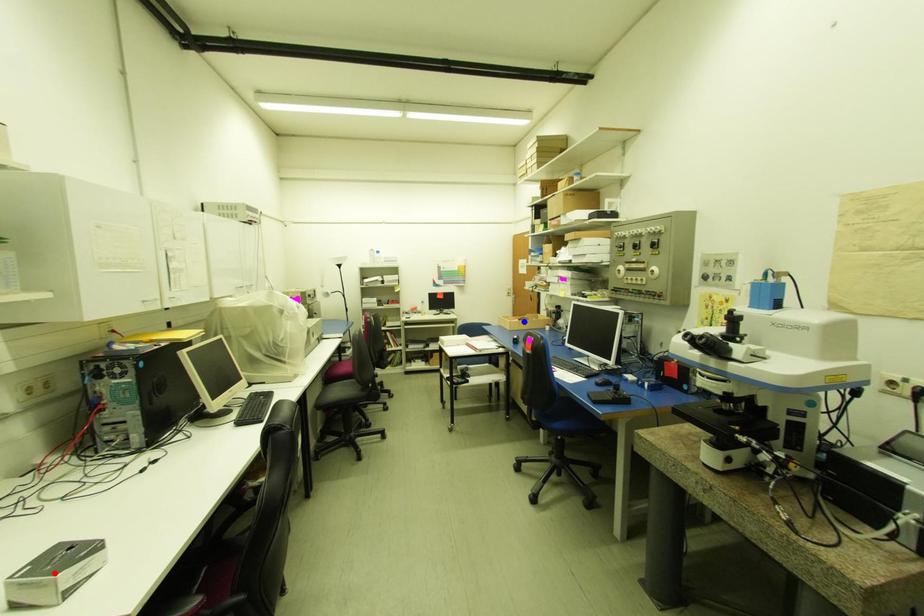
Question: Two points are marked on the image. Which point is closer to the camera?

Choices:
 (A) Blue point is closer.
 (B) Red point is closer.

Answer: (B)